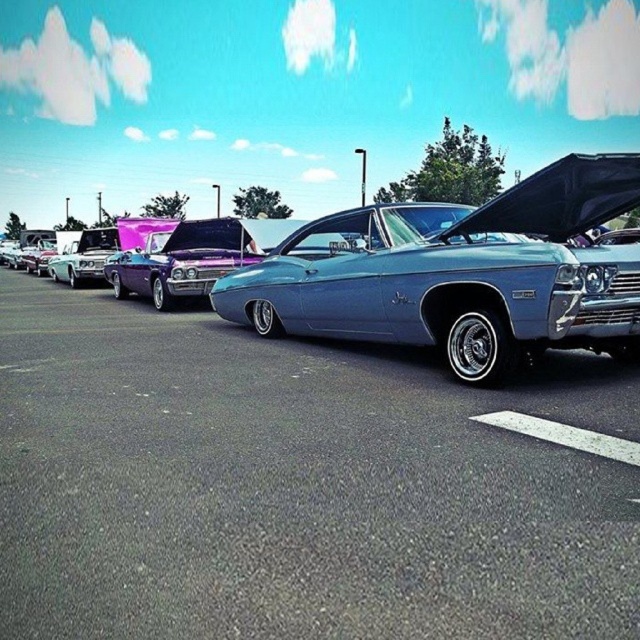
You are a photographer trying to capture a photo of the metallic blue car at center and the shiny chrome truck at left. Since you want to include both in the frame, which vehicle should you position closer to the camera to make them appear the same size?

The metallic blue car at center is shorter than the shiny chrome truck at left. To make them appear the same size in the photo, you should position the metallic blue car at center closer to the camera than the shiny chrome truck at left.

You are a photographer setting up a shot of the shiny chrome truck at left and the white asphalt line at center. Which object will appear narrower in the photo?

The white asphalt line at center will appear narrower in the photo because it is thinner than the shiny chrome truck at left.

You are a photographer wanting to capture both the metallic blue muscle car at center and the shiny chrome truck at left in a single frame. Given their sizes, which one should you position closer to the camera to ensure both appear proportionally balanced in the photo?

Since the metallic blue muscle car at center is shorter than the shiny chrome truck at left, you should position the metallic blue muscle car at center closer to the camera to balance their sizes in the photo.